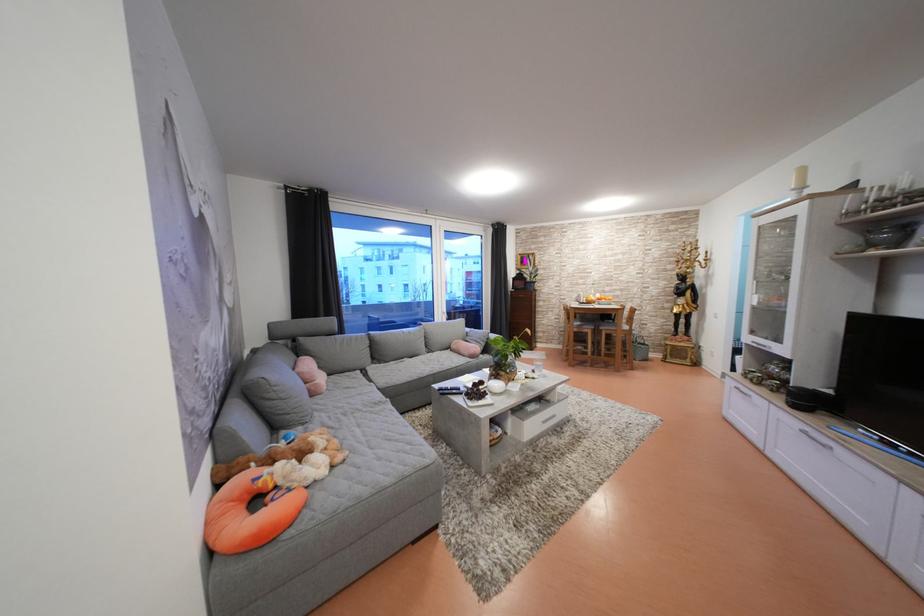
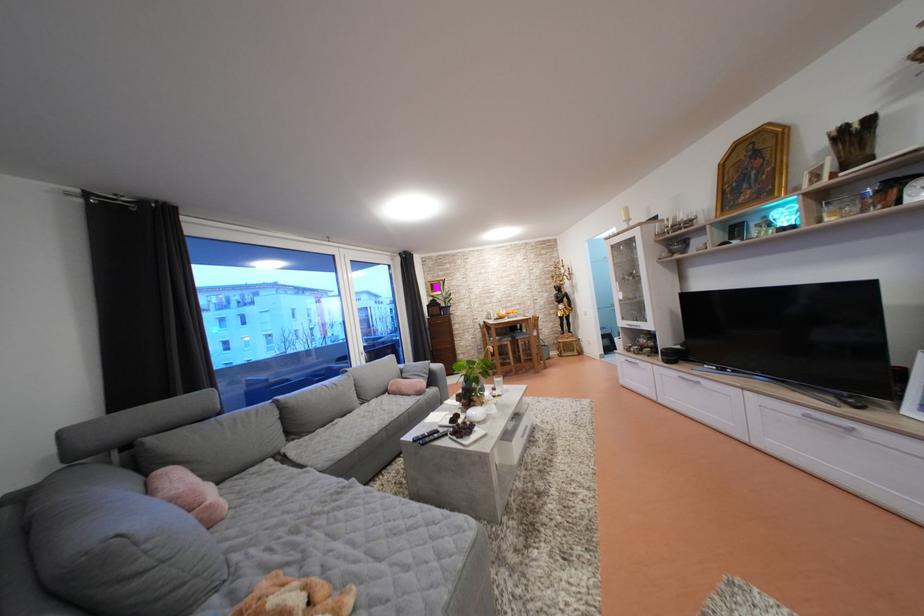
Locate, in the second image, the point that corresponds to the point at 475,334 in the first image.

(408, 371)